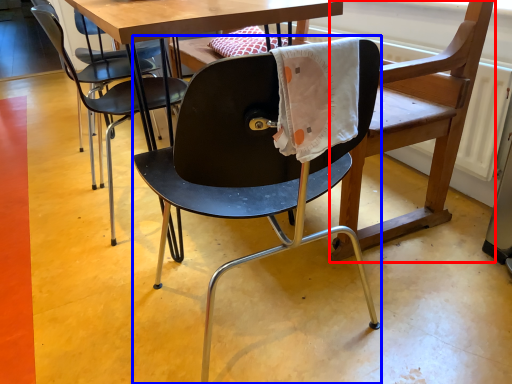
Question: Which point is further to the camera, swivel chair (highlighted by a red box) or chair (highlighted by a blue box)?

Choices:
 (A) swivel chair
 (B) chair

Answer: (A)